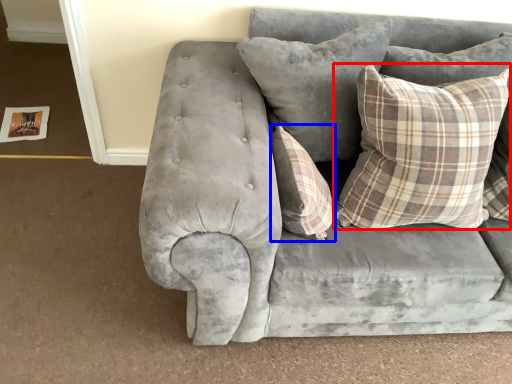
Question: Which object appears farthest to the camera in this image, pillow (highlighted by a red box) or pillow (highlighted by a blue box)?

Choices:
 (A) pillow
 (B) pillow

Answer: (B)